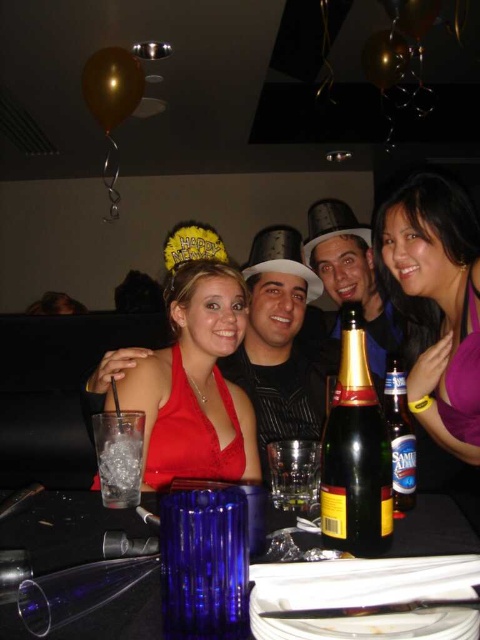
Question: From the image, what is the correct spatial relationship of matte red dress at center in relation to purple matte shirt at right?

Choices:
 (A) left
 (B) right

Answer: (A)

Question: Which point appears closest to the camera in this image?

Choices:
 (A) (355, 468)
 (B) (459, 253)
 (C) (308, 545)

Answer: (A)

Question: From the image, what is the correct spatial relationship of matte red dress at center in relation to green glass bottle at center?

Choices:
 (A) below
 (B) above

Answer: (B)

Question: Does matte red dress at center appear over shiny gold hat at center?

Choices:
 (A) yes
 (B) no

Answer: (B)

Question: Which point appears closest to the camera in this image?

Choices:
 (A) (121, 486)
 (B) (279, 513)

Answer: (B)

Question: Which of the following is the closest to the observer?

Choices:
 (A) clear glass at lower left
 (B) blue glass vase at lower center
 (C) clear glass bottle at center
 (D) purple matte shirt at right

Answer: (B)